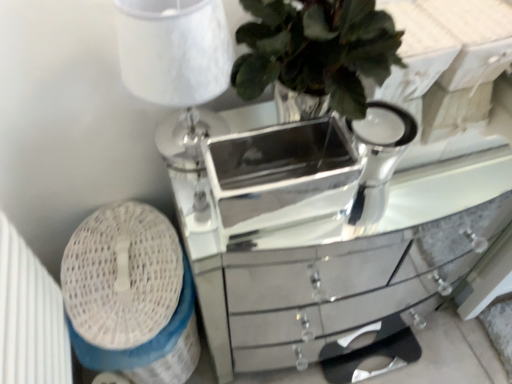
Question: From the image's perspective, relative to white textured lampshade at upper left, is silver/metallic mirrored tray at center above or below?

Choices:
 (A) below
 (B) above

Answer: (A)

Question: Based on their positions, is silver/metallic mirrored tray at center located to the left or right of white textured lampshade at upper left?

Choices:
 (A) left
 (B) right

Answer: (B)

Question: Estimate the real-world distances between objects in this image. Which object is farther from the white textured lampshade at upper left?

Choices:
 (A) silver/metallic mirrored tray at center
 (B) mirrored silver chest of drawers at center

Answer: (A)

Question: Which of these objects is positioned closest to the white textured lampshade at upper left?

Choices:
 (A) mirrored silver chest of drawers at center
 (B) silver/metallic mirrored tray at center

Answer: (A)